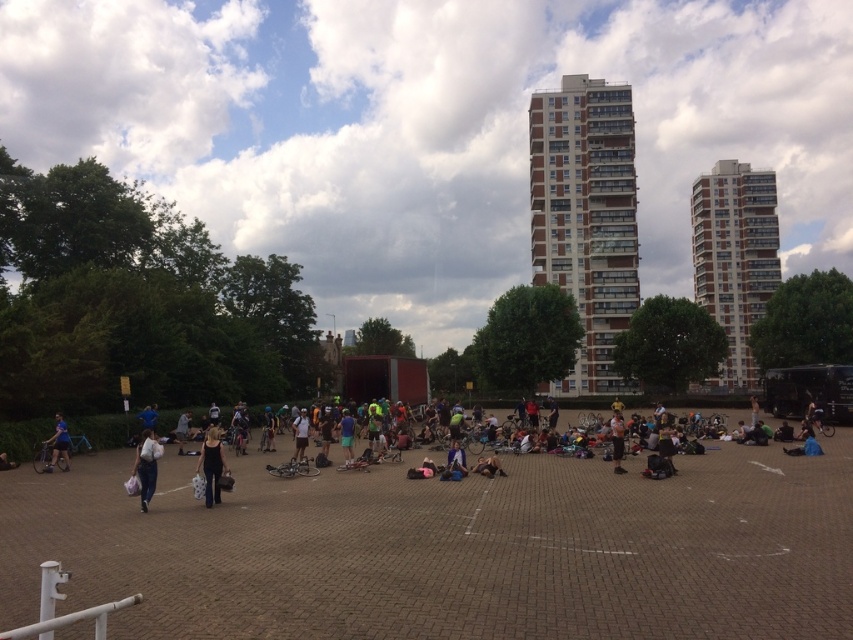
Question: Does brown brick building at upper right appear on the left side of matte blue shorts at lower left?

Choices:
 (A) no
 (B) yes

Answer: (A)

Question: Is brown brick building at upper right in front of white cotton shirt at center?

Choices:
 (A) no
 (B) yes

Answer: (A)

Question: Estimate the real-world distances between objects in this image. Which object is farther from the black matte tank top at center?

Choices:
 (A) brown brick building at center
 (B) brown brick building at upper right
 (C) white fabric bag at center

Answer: (B)

Question: Where is brown brick building at upper right located in relation to black matte tank top at center in the image?

Choices:
 (A) above
 (B) below

Answer: (A)

Question: Among these objects, which one is nearest to the camera?

Choices:
 (A) white fabric bag at center
 (B) white cotton shirt at center
 (C) matte blue shorts at lower left

Answer: (A)

Question: Which object is farther from the camera taking this photo?

Choices:
 (A) matte blue shorts at lower left
 (B) white cotton shirt at center
 (C) white fabric bag at center

Answer: (A)